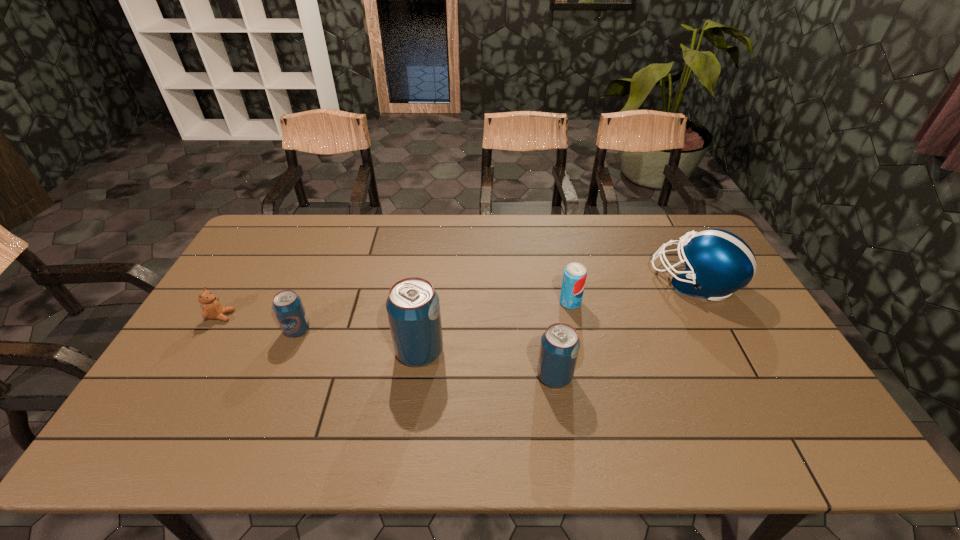
Identify the location of object at the right edge. The width and height of the screenshot is (960, 540). (718, 263).

Where is `free space at the far edge of the desktop`? free space at the far edge of the desktop is located at coordinates (578, 248).

In the image, there is a desktop. Where is `blank space at the near edge`? The image size is (960, 540). blank space at the near edge is located at coordinates (718, 411).

In the image, there is a desktop. Identify the location of free region at the left edge. This screenshot has width=960, height=540. (192, 351).

At what (x,y) coordinates should I click in order to perform the action: click on vacant space at the right edge of the desktop. Please return your answer as a coordinate pair (x, y). Image resolution: width=960 pixels, height=540 pixels. Looking at the image, I should click on (767, 383).

In the image, there is a desktop. Where is `vacant space at the far right corner`? The height and width of the screenshot is (540, 960). vacant space at the far right corner is located at coordinates (685, 230).

Find the location of a particular element. The image size is (960, 540). unoccupied position between the leftmost object and the second soda can from right to left is located at coordinates [x=388, y=346].

Where is `empty space between the second object from right to left and the tallest soda can`? empty space between the second object from right to left and the tallest soda can is located at coordinates (x=494, y=327).

Identify the location of vacant point located between the teddy bear and the fourth shortest object. (388, 346).

Locate an element on the screen. The image size is (960, 540). vacant area that lies between the third soda can from left to right and the leftmost object is located at coordinates (388, 346).